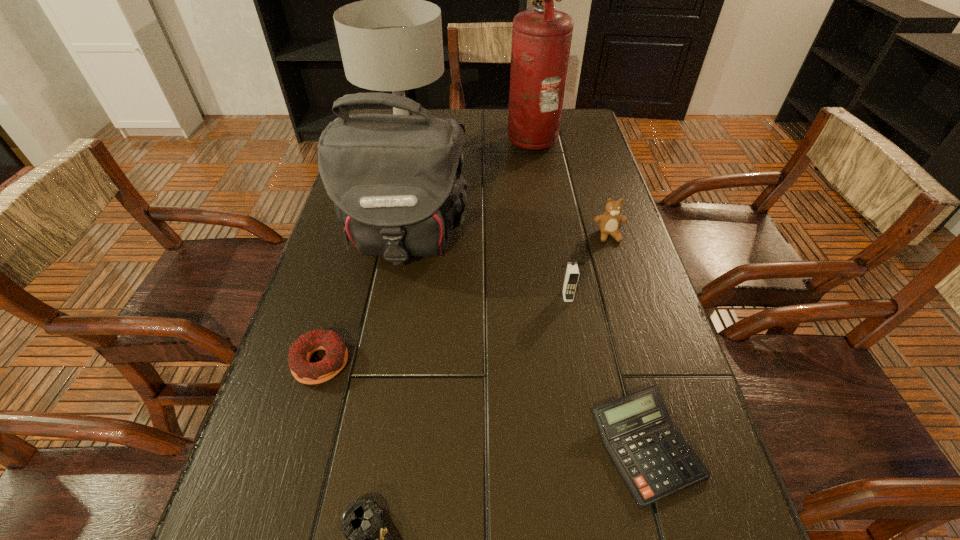
At what (x,y) coordinates should I click in order to perform the action: click on shoulder bag present at the left edge. Please return your answer as a coordinate pair (x, y). This screenshot has width=960, height=540. Looking at the image, I should click on (396, 181).

Identify the location of doughnut at the left edge. The width and height of the screenshot is (960, 540). (301, 351).

Identify the location of fire extinguisher that is positioned at the right edge. (541, 37).

The image size is (960, 540). Find the location of `teddy bear that is at the right edge`. teddy bear that is at the right edge is located at coordinates coord(609,222).

You are a GUI agent. You are given a task and a screenshot of the screen. Output one action in this format:
    pyautogui.click(x=<x>, y=<y>)
    Task: Click on the calculator that is at the right edge
    The width and height of the screenshot is (960, 540).
    Given the screenshot: What is the action you would take?
    pyautogui.click(x=653, y=459)

You are a GUI agent. You are given a task and a screenshot of the screen. Output one action in this format:
    pyautogui.click(x=<x>, y=<y>)
    Task: Click on the object present at the far left corner
    
    Given the screenshot: What is the action you would take?
    pyautogui.click(x=392, y=40)

Image resolution: width=960 pixels, height=540 pixels. What are the coordinates of `object that is at the far right corner` in the screenshot? It's located at (541, 37).

Locate an element on the screen. free region at the far edge of the desktop is located at coordinates (491, 124).

At what (x,y) coordinates should I click in order to perform the action: click on free space at the left edge of the desktop. Please return your answer as a coordinate pair (x, y). The height and width of the screenshot is (540, 960). Looking at the image, I should click on (358, 349).

You are a GUI agent. You are given a task and a screenshot of the screen. Output one action in this format:
    pyautogui.click(x=<x>, y=<y>)
    Task: Click on the free space at the right edge of the desktop
    The image size is (960, 540).
    Given the screenshot: What is the action you would take?
    pyautogui.click(x=625, y=343)